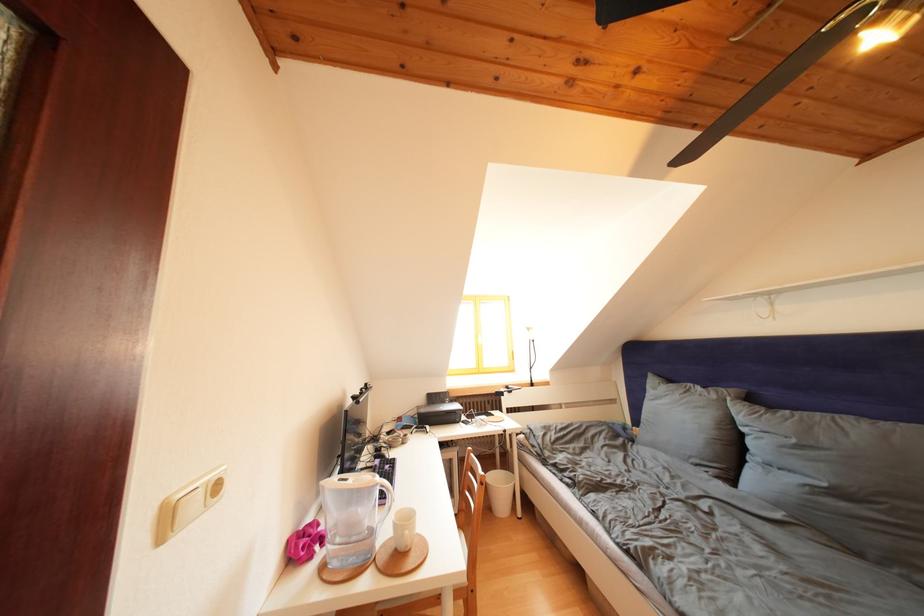
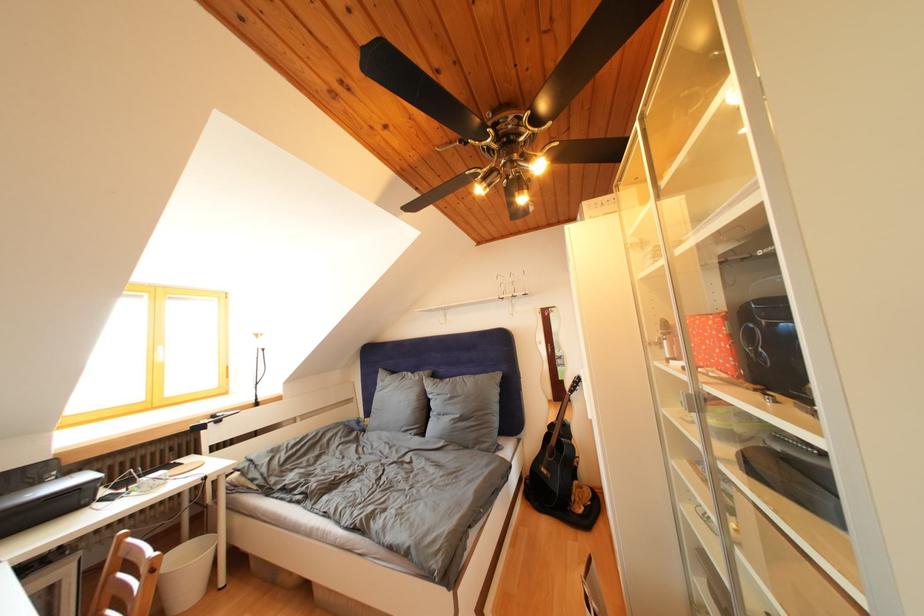
Where in the second image is the point corresponding to point (475, 476) from the first image?

(119, 578)